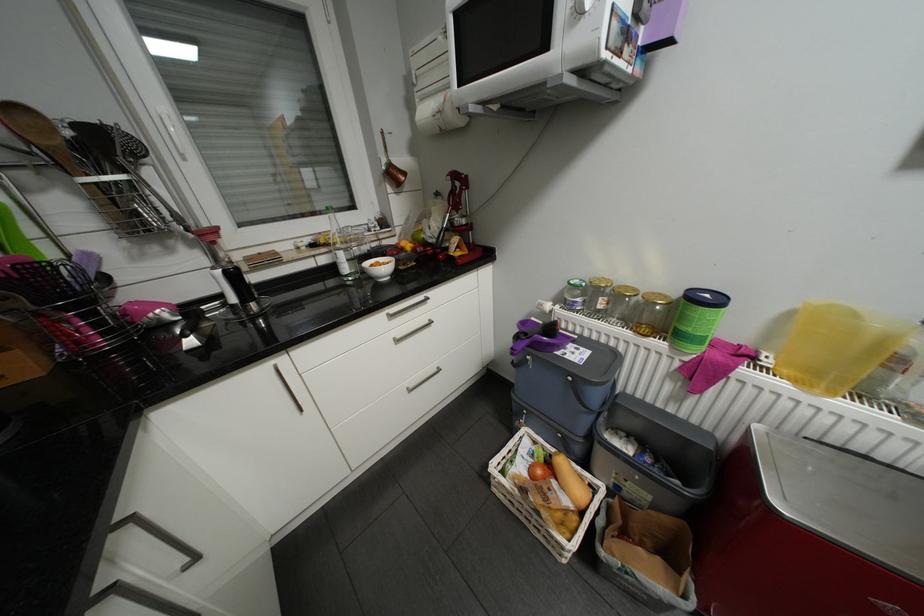
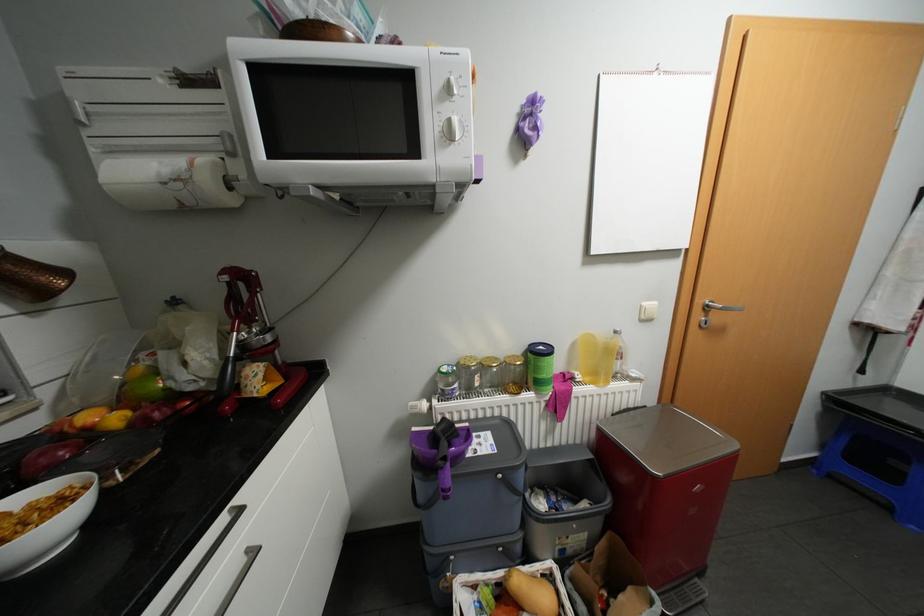
Where in the second image is the point corresponding to point 438,318 from the first image?

(256, 549)